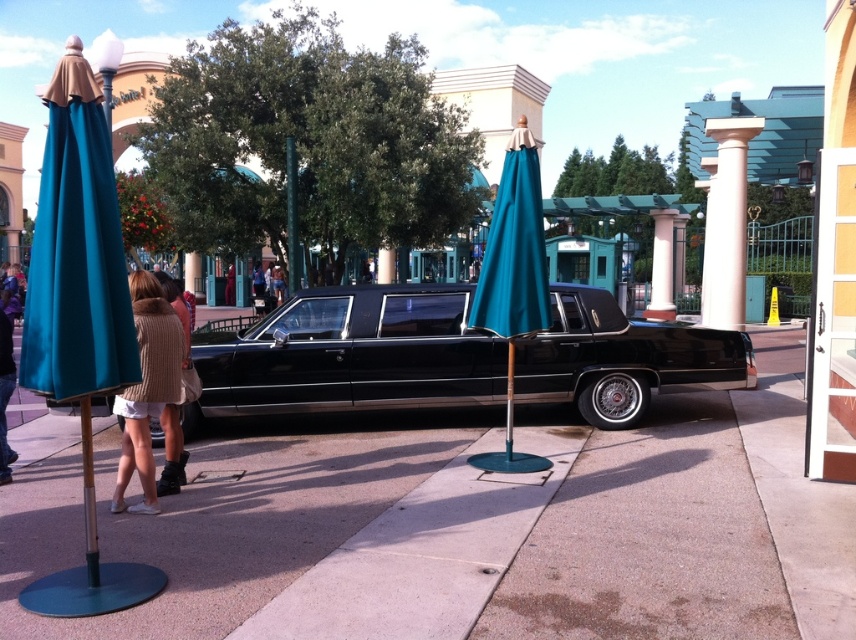
You are a visitor at the park and want to take a photo of the teal fabric umbrella at center and the pink polished stone column at center. Which object is shorter?

The teal fabric umbrella at center is shorter than the pink polished stone column at center.

You are standing at the center of the paved area and want to reach the classic black limousine parked nearby. Which direction should you move to get to the limousine from the point indicated by point (x=513, y=280)?

The point (x=513, y=280) indicates the teal fabric umbrella at center. To reach the classic black limousine parked nearby, you should move away from the teal fabric umbrella at center towards the limousine.

You are a guest at the themed park and want to take a photo of the black glossy limousine at center and the pink polished stone column at center. If you stand to the right of the column, will the limousine be visible in your photo?

The black glossy limousine at center is to the left of the pink polished stone column at center. If you stand to the right of the column, the limousine will be visible to your left side, so yes, it will be in the photo.